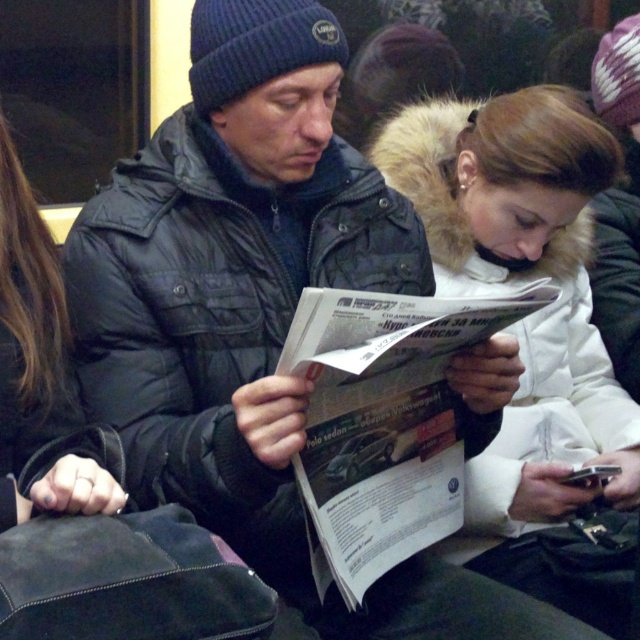
You are a photographer trying to capture a candid shot of both the white fur coat at center and the black leather jacket at center. Since you can only focus on one subject at a time, which one should you aim your camera at first to ensure the other is still in frame?

You should aim your camera at the black leather jacket at center first because the white fur coat at center is to the right of it, so focusing on the leftmost subject ensures the rightward subject remains in frame.

You are a photographer trying to capture both the white fur coat at center and the black leather jacket at center in a single frame. Given their sizes, which one should you focus on to ensure both are clearly visible in the photo?

The white fur coat at center is larger in size than the black leather jacket at center, so focusing on the white fur coat at center would allow both to be captured clearly as it occupies more space and can be positioned to include the smaller black leather jacket at center in the frame.